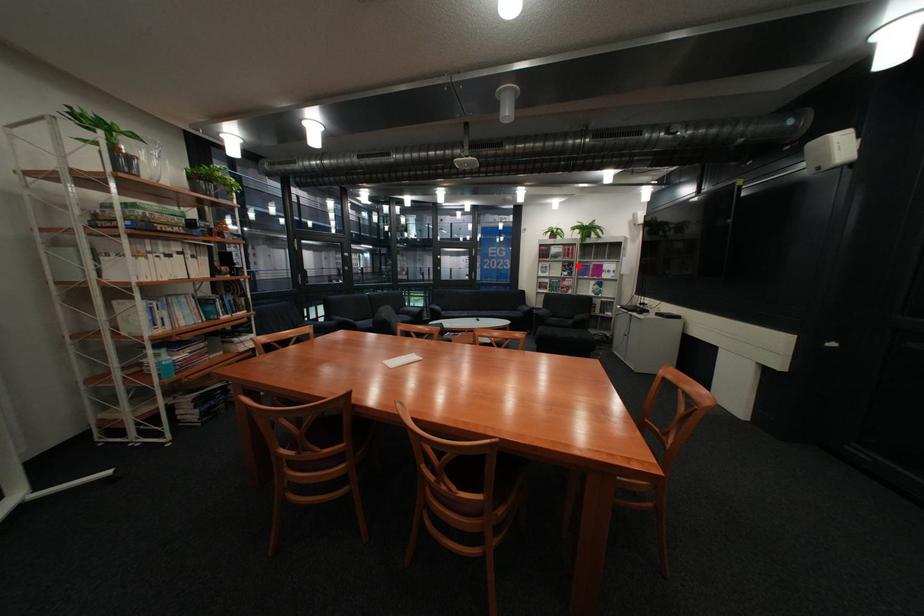
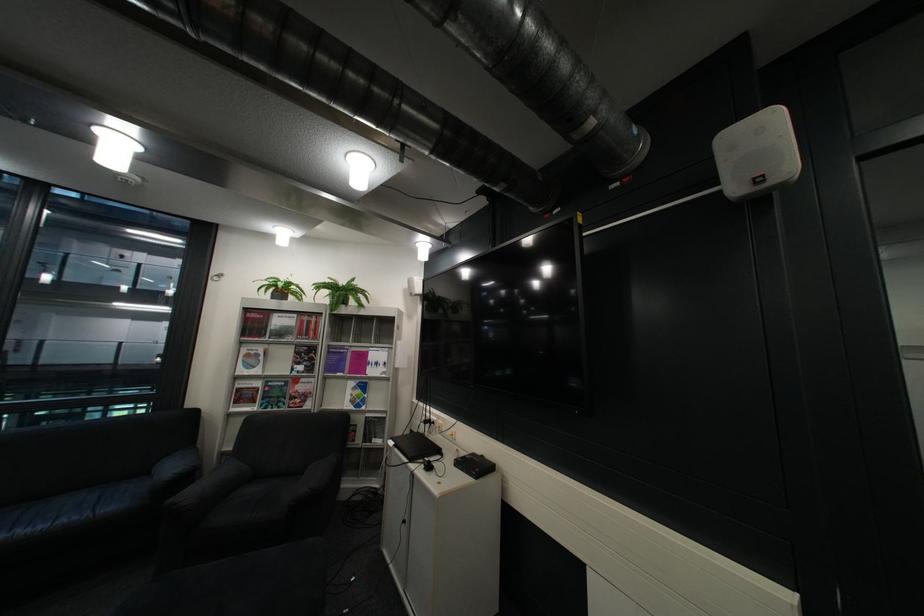
Question: I am providing you with two images of the same scene from different viewpoints. In image1, a red point is highlighted. Considering the same 3D point in image2, which of the following is correct?

Choices:
 (A) It is closer
 (B) It is farther

Answer: (B)